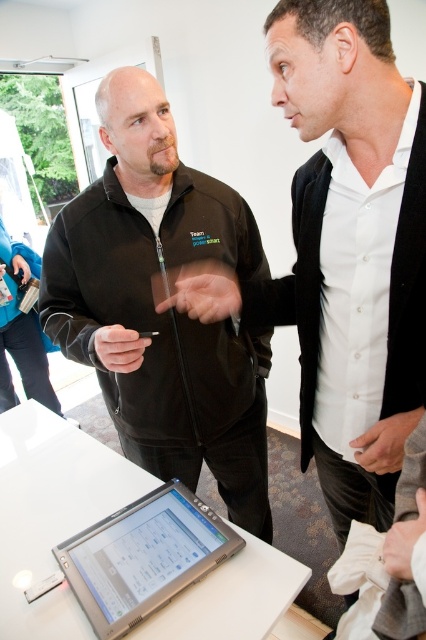
You are standing in the room where the two people are talking. You need to locate the black matte jacket at upper left and the silver metallic laptop at lower center. Which object is positioned more to the left?

The silver metallic laptop at lower center is positioned more to the left because the black matte jacket at upper left is to the right of it.